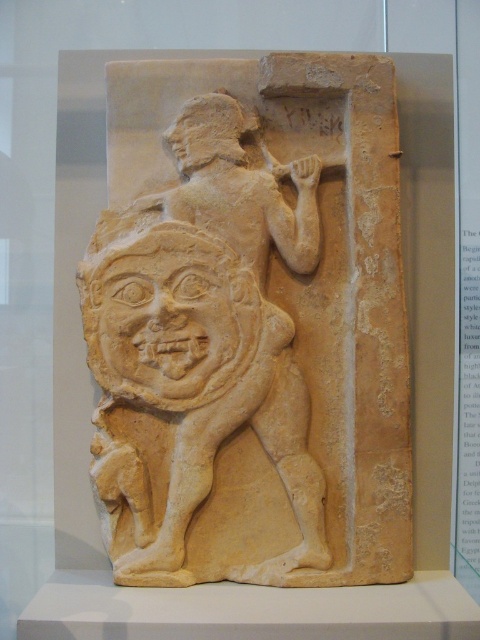
You are an art student analyzing the ancient relief sculpture. You notice the beige stone relief at center and the beige stone warrior at center. Which object is positioned lower in the scene?

The beige stone relief at center is positioned lower than the beige stone warrior at center.

You are a museum visitor standing in front of the ancient relief sculpture. You see the beige stone relief at center and the beige stone warrior at center. Which object is positioned to the right of the other?

The beige stone relief at center is positioned to the right of the beige stone warrior at center.